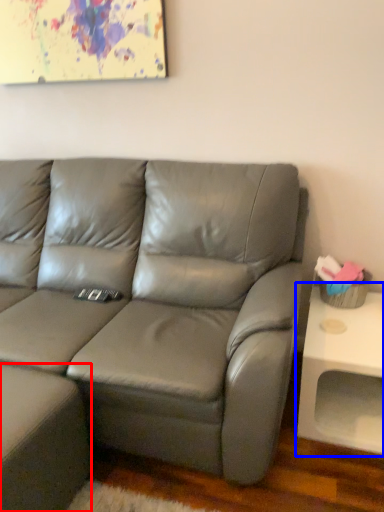
Question: Among these objects, which one is farthest to the camera, footrest (highlighted by a red box) or table (highlighted by a blue box)?

Choices:
 (A) footrest
 (B) table

Answer: (B)